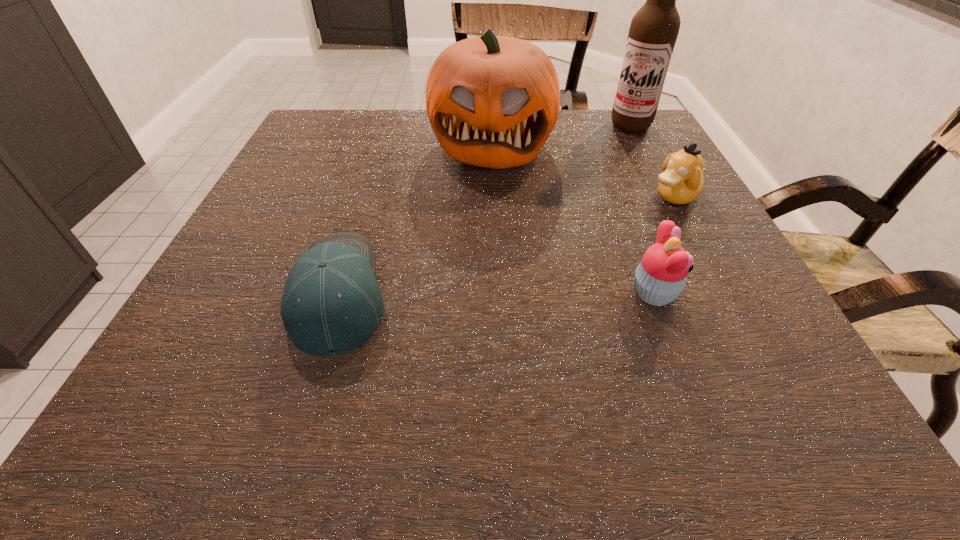
Locate an element on the screen. This screenshot has height=540, width=960. vacant area at the left edge of the desktop is located at coordinates (276, 176).

You are a GUI agent. You are given a task and a screenshot of the screen. Output one action in this format:
    pyautogui.click(x=<x>, y=<y>)
    Task: Click on the free space at the right edge of the desktop
    The height and width of the screenshot is (540, 960).
    Given the screenshot: What is the action you would take?
    pyautogui.click(x=671, y=215)

Where is `vacant space at the near left corner of the desktop`? vacant space at the near left corner of the desktop is located at coordinates (174, 370).

Where is `vacant space at the near right corner of the desktop`? vacant space at the near right corner of the desktop is located at coordinates (677, 325).

Locate an element on the screen. The image size is (960, 540). free space between the duckling and the baseball cap is located at coordinates (507, 245).

Find the location of a particular element. free space between the leftmost object and the second tallest object is located at coordinates (416, 218).

Where is `free space between the leftmost object and the duckling`? This screenshot has width=960, height=540. free space between the leftmost object and the duckling is located at coordinates (507, 245).

At what (x,y) coordinates should I click in order to perform the action: click on vacant region between the baseball cap and the cupcake. Please return your answer as a coordinate pair (x, y). The width and height of the screenshot is (960, 540). Looking at the image, I should click on (497, 293).

Locate an element on the screen. The height and width of the screenshot is (540, 960). free space between the third object from left to right and the alcohol is located at coordinates (642, 210).

The height and width of the screenshot is (540, 960). What are the coordinates of `free spot between the pumpkin and the alcohol` in the screenshot? It's located at (561, 134).